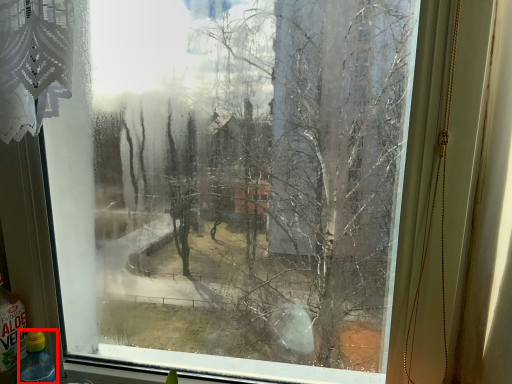
Question: From the image's perspective, what is the correct spatial relationship of bottle (annotated by the red box) in relation to bottle?

Choices:
 (A) below
 (B) above

Answer: (A)